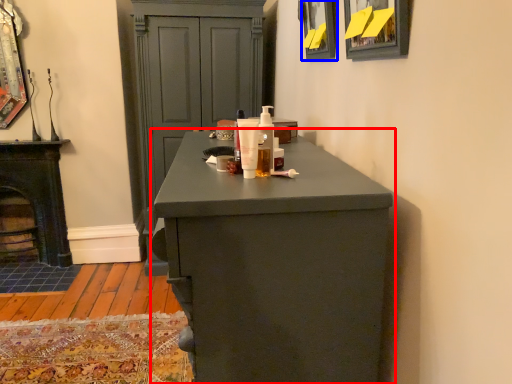
Question: Among these objects, which one is farthest to the camera, chest of drawers (highlighted by a red box) or picture frame (highlighted by a blue box)?

Choices:
 (A) chest of drawers
 (B) picture frame

Answer: (B)